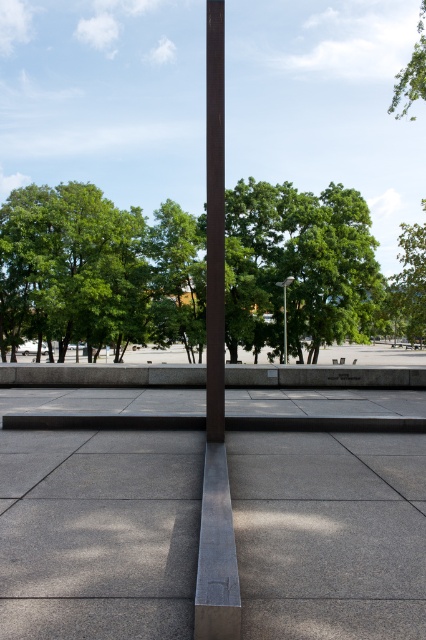
Between gray concrete pavement at center and white plastic street sign at upper center, which one is positioned lower?

gray concrete pavement at center is below.

Is gray concrete pavement at center positioned before white plastic street sign at upper center?

Yes.

At what (x,y) coordinates should I click in order to perform the action: click on gray concrete pavement at center. Please return your answer as a coordinate pair (x, y). Looking at the image, I should click on (98, 532).

The width and height of the screenshot is (426, 640). Find the location of `gray concrete pavement at center`. gray concrete pavement at center is located at coordinates (x=98, y=532).

Can you confirm if white plastic street sign at upper center is thinner than wooden park bench at center?

Correct, white plastic street sign at upper center's width is less than wooden park bench at center's.

Is white plastic street sign at upper center smaller than wooden park bench at center?

No.

Between point (287, 282) and point (342, 358), which one is positioned behind?

The point (342, 358) is more distant.

Locate an element on the screen. This screenshot has height=640, width=426. white plastic street sign at upper center is located at coordinates (284, 310).

Is point (218, 276) less distant than point (333, 362)?

Yes.

Does satin brown pole at center lie in front of wooden park bench at center?

Yes, it is in front of wooden park bench at center.

Who is more forward, (213, 38) or (331, 360)?

Point (213, 38)

Locate an element on the screen. satin brown pole at center is located at coordinates (215, 374).